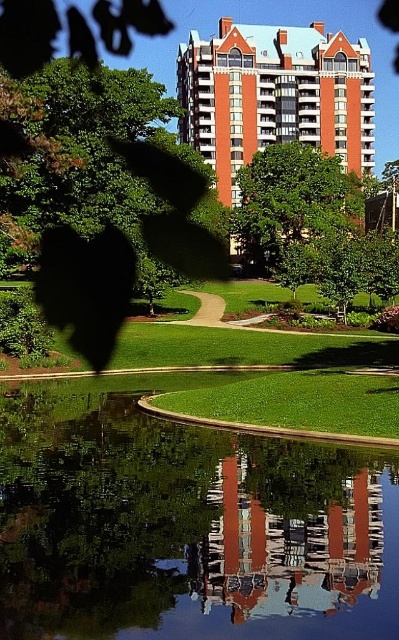
Question: Does smooth glass building at center come behind green leafy tree at upper left?

Choices:
 (A) no
 (B) yes

Answer: (A)

Question: Does transparent glass water at center appear over smooth glass building at center?

Choices:
 (A) no
 (B) yes

Answer: (A)

Question: Which object appears farthest from the camera in this image?

Choices:
 (A) orange brick building at center
 (B) smooth glass building at center
 (C) transparent glass water at center
 (D) green leafy tree at upper left

Answer: (A)

Question: Does transparent glass water at center have a greater width compared to orange brick building at center?

Choices:
 (A) yes
 (B) no

Answer: (B)

Question: Which point is closer to the camera taking this photo?

Choices:
 (A) (339, 74)
 (B) (106, 433)

Answer: (B)

Question: Among these points, which one is nearest to the camera?

Choices:
 (A) (300, 90)
 (B) (19, 128)
 (C) (274, 605)

Answer: (C)